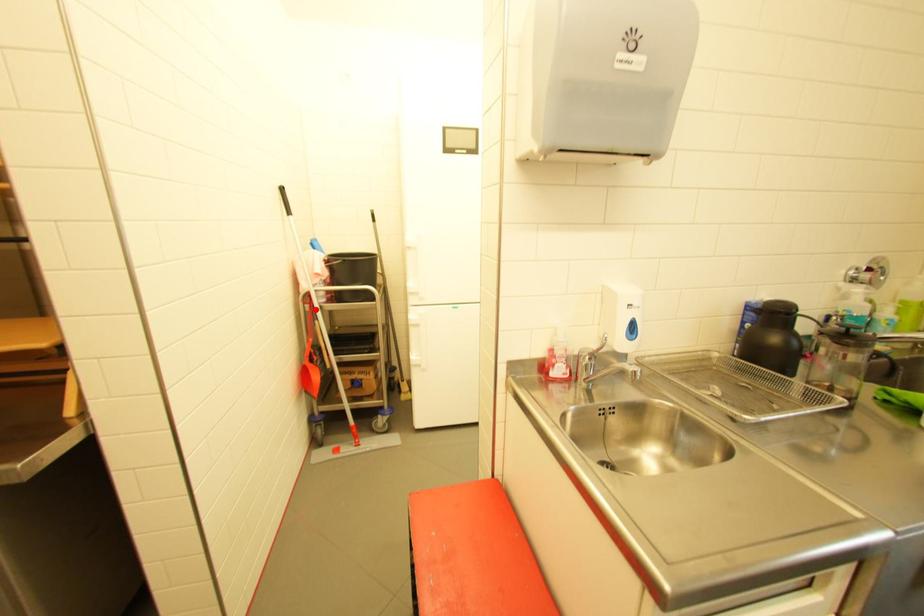
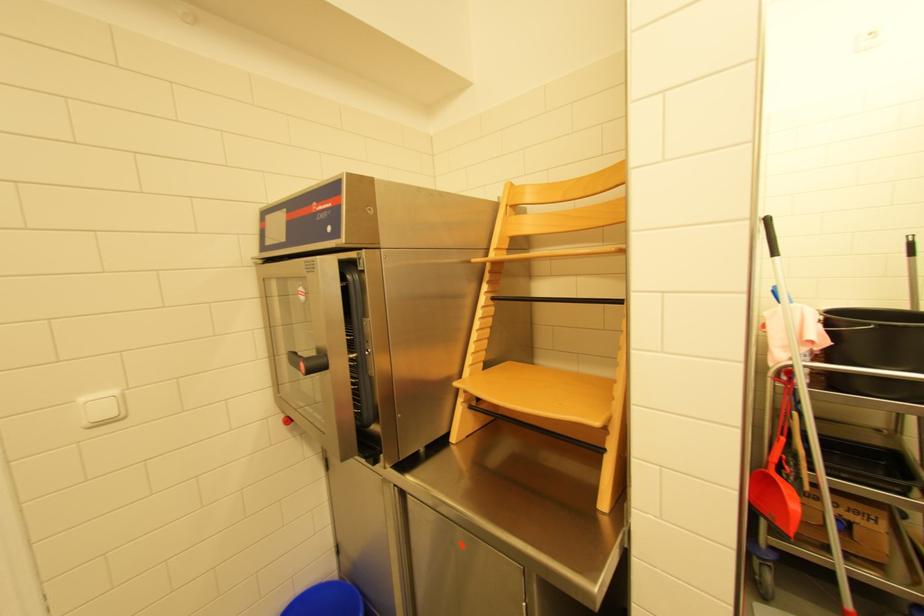
Find the pixel in the second image that matches the highlighted location in the first image.

(787, 391)